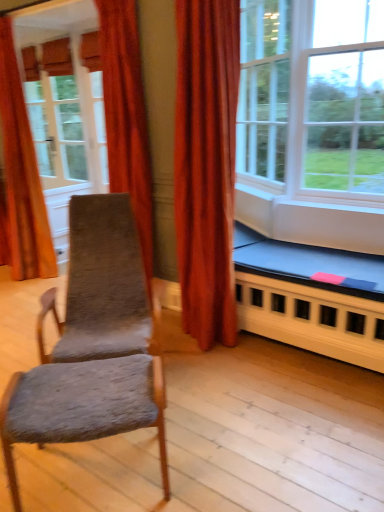
Locate an element on the screen. vacant space underneath textured gray fabric chair at center (from a real-world perspective) is located at coordinates (94, 473).